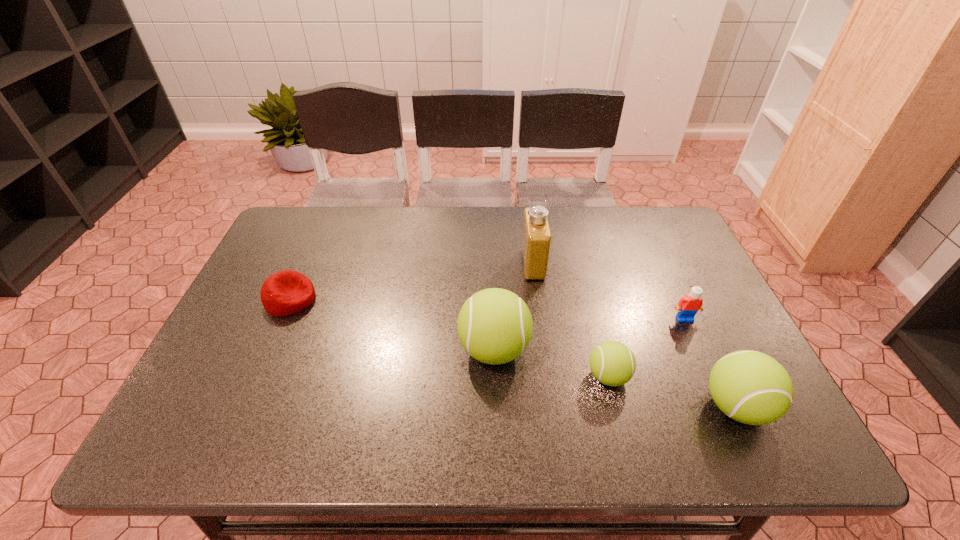
The height and width of the screenshot is (540, 960). What are the coordinates of `unoccupied position between the third object from right to left and the Lego` in the screenshot? It's located at (646, 348).

Where is `vacant space in between the second tennis ball from right to left and the leftmost tennis ball`? This screenshot has height=540, width=960. vacant space in between the second tennis ball from right to left and the leftmost tennis ball is located at coordinates (551, 363).

Find the location of a particular element. Image resolution: width=960 pixels, height=540 pixels. vacant area that lies between the fifth object from right to left and the fourth object from left to right is located at coordinates (551, 363).

Locate an element on the screen. This screenshot has width=960, height=540. free point between the leftmost tennis ball and the Lego is located at coordinates (589, 334).

This screenshot has width=960, height=540. Identify the location of free space between the shortest tennis ball and the fourth object from right to left. (570, 320).

Locate an element on the screen. The width and height of the screenshot is (960, 540). vacant space that is in between the shortest object and the fourth object from right to left is located at coordinates (412, 282).

Locate which object ranks third in proximity to the Lego. Please provide its 2D coordinates. Your answer should be formatted as a tuple, i.e. [(x, y)], where the tuple contains the x and y coordinates of a point satisfying the conditions above.

[(536, 241)]

Locate an element on the screen. object that is the third closest one to the fourth object from right to left is located at coordinates (688, 306).

Choose which tennis ball is the nearest neighbor to the shortest object. Please provide its 2D coordinates. Your answer should be formatted as a tuple, i.e. [(x, y)], where the tuple contains the x and y coordinates of a point satisfying the conditions above.

[(494, 326)]

Identify the location of tennis ball that is the closest one to the leftmost tennis ball. The height and width of the screenshot is (540, 960). (612, 363).